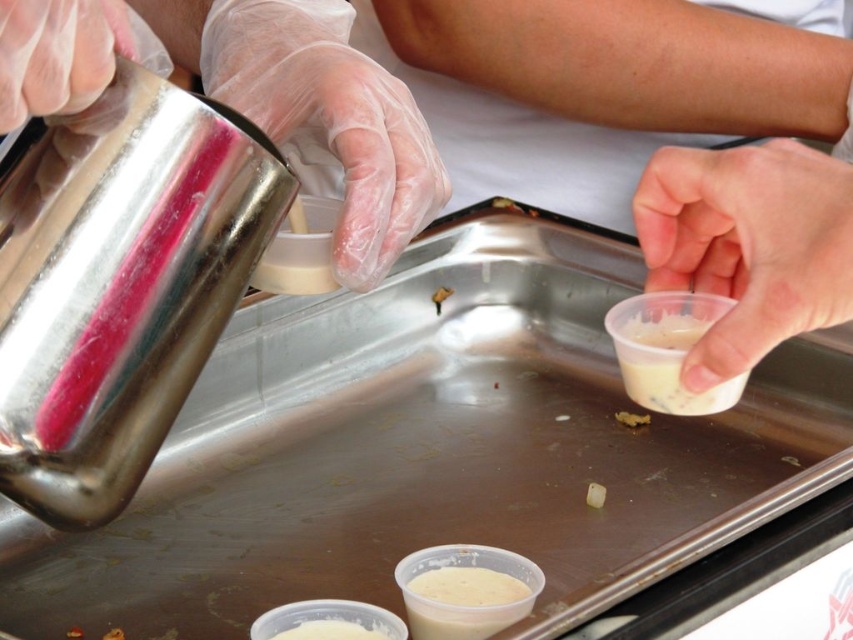
From the picture: Does transparent plastic cup at upper right have a greater width compared to white matte cube at center?

Indeed, transparent plastic cup at upper right has a greater width compared to white matte cube at center.

Looking at this image, can you confirm if transparent plastic cup at upper right is positioned to the left of white matte cube at center?

Indeed, transparent plastic cup at upper right is positioned on the left side of white matte cube at center.

Which is behind, point (751, 19) or point (602, 493)?

The point (751, 19) is more distant.

I want to click on transparent plastic cup at upper right, so click(518, 124).

Does transparent plastic cup at upper right have a lesser width compared to white creamy substance at lower center?

No.

Between point (792, 81) and point (314, 632), which one is positioned in front?

Point (314, 632) is in front.

The image size is (853, 640). What are the coordinates of `transparent plastic cup at upper right` in the screenshot? It's located at (518, 124).

Image resolution: width=853 pixels, height=640 pixels. Find the location of `transparent plastic cup at upper right`. transparent plastic cup at upper right is located at coordinates (518, 124).

Can you confirm if white creamy substance at lower center is positioned below white matte cube at center?

Yes.

Is white creamy substance at lower center wider than white matte cube at center?

Yes.

What do you see at coordinates (334, 630) in the screenshot?
I see `white creamy substance at lower center` at bounding box center [334, 630].

Identify the location of white creamy substance at lower center. The image size is (853, 640). (334, 630).